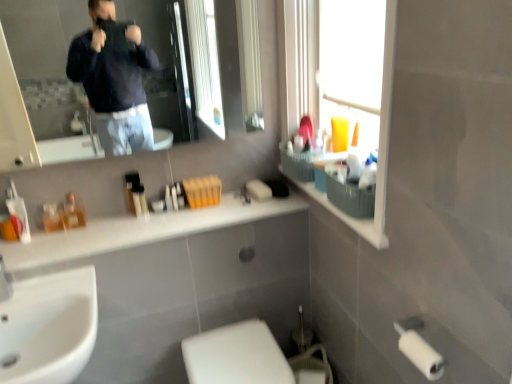
Question: Looking at their shapes, would you say white glossy toilet at lower center is wider or thinner than white matte soap at center?

Choices:
 (A) wide
 (B) thin

Answer: (A)

Question: Is white glossy toilet at lower center spatially inside white matte soap at center, or outside of it?

Choices:
 (A) outside
 (B) inside

Answer: (A)

Question: Which object is positioned closest to the transparent plastic window screen at upper right?

Choices:
 (A) translucent plastic tubes at center, which is counted as the 1th toiletry, starting from the right
 (B) white matte soap at center
 (C) translucent plastic basket at upper right
 (D) white glossy toilet at lower center
 (E) translucent glass perfume at center, the second toiletry positioned from the left

Answer: (C)

Question: Estimate the real-world distances between objects in this image. Which object is closer to the translucent glass perfume at center, the 2th toiletry viewed from the right?

Choices:
 (A) transparent plastic window screen at upper right
 (B) translucent plastic bottles at left, the third toiletry in the right-to-left sequence
 (C) white glossy toilet at lower center
 (D) white matte soap at center
 (E) translucent plastic basket at upper right

Answer: (B)